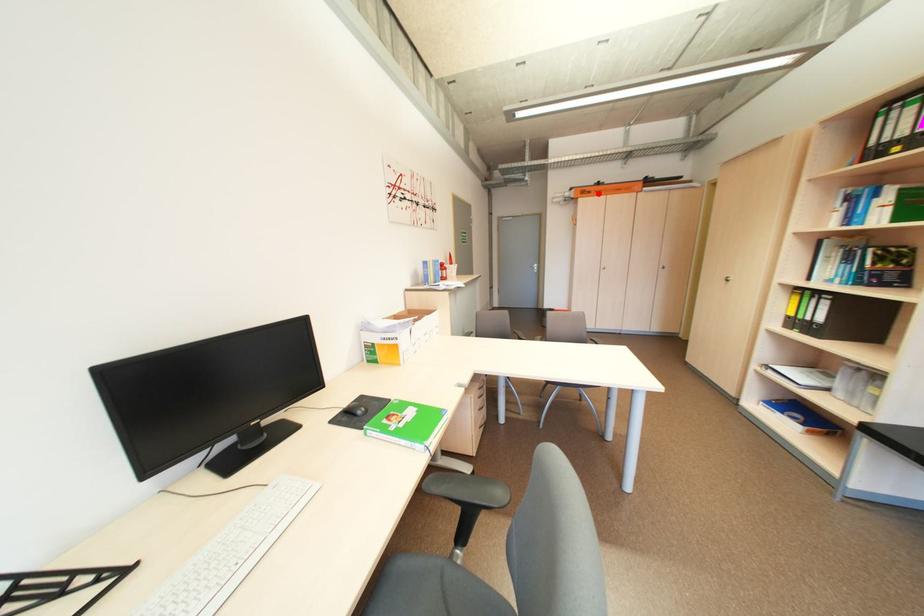
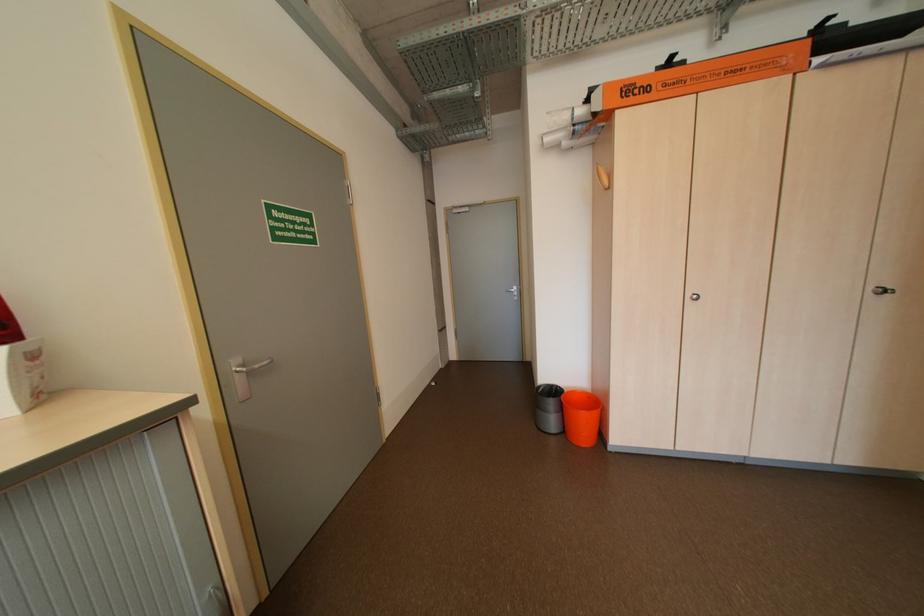
The point at the highlighted location is marked in the first image. Where is the corresponding point in the second image?

(655, 90)